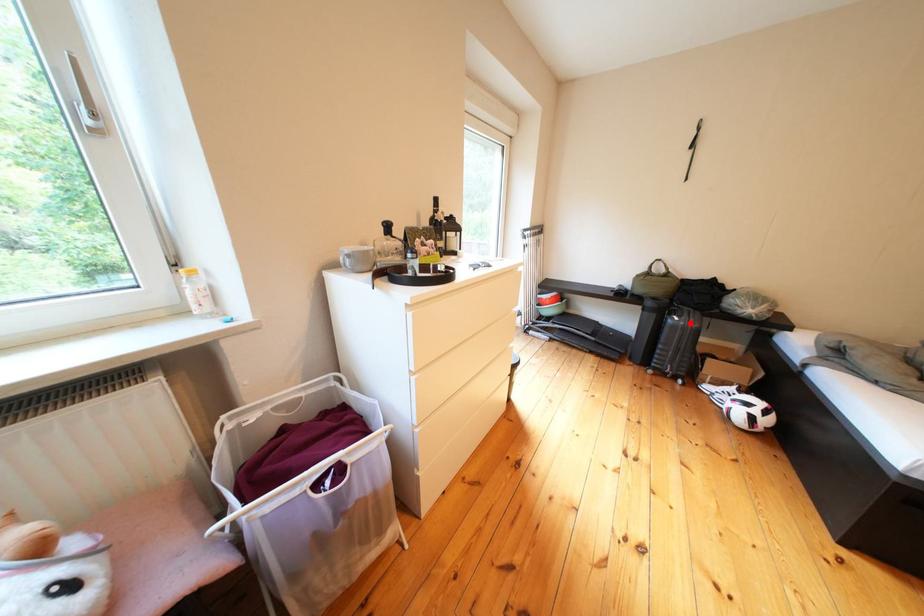
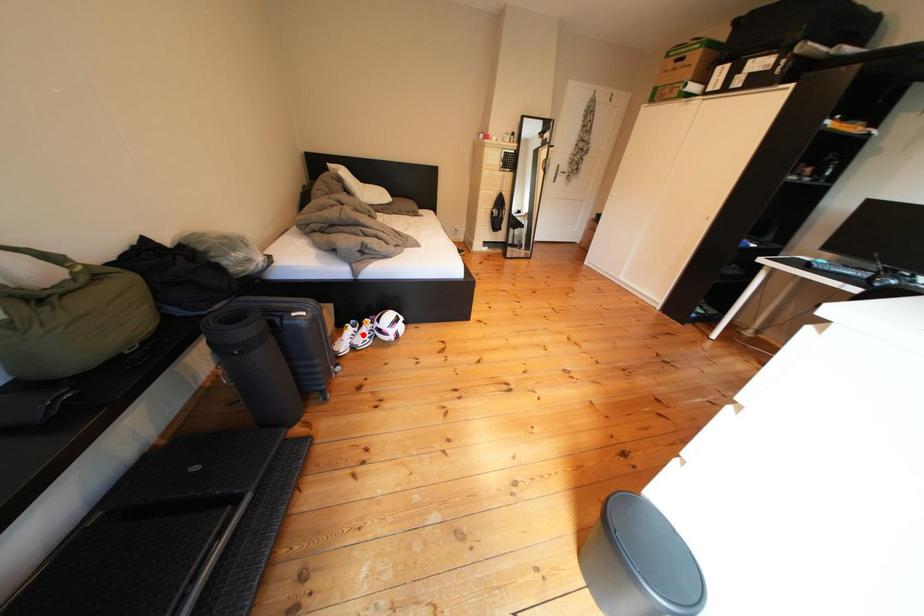
I am providing you with two images of the same scene from different viewpoints. A red point is marked on the first image and another point is marked on the second image. Do the highlighted points in image1 and image2 indicate the same real-world spot?

No